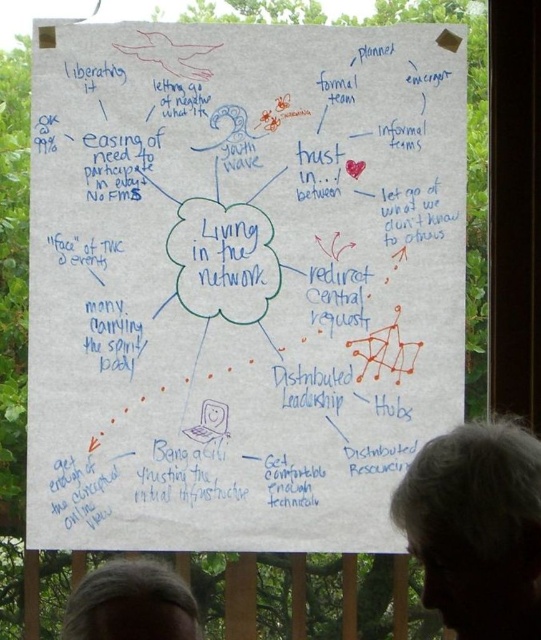
Can you confirm if white paper at center is positioned to the left of gray hair at lower right?

Yes, white paper at center is to the left of gray hair at lower right.

Who is more distant from viewer, (392,369) or (507,468)?

Point (392,369)

What are the coordinates of `white paper at center` in the screenshot? It's located at 240,282.

Locate an element on the screen. white paper at center is located at coordinates (240, 282).

Can you confirm if white paper at center is positioned below gray hair at lower left?

No.

Between point (405, 412) and point (161, 634), which one is positioned in front?

Positioned in front is point (161, 634).

The height and width of the screenshot is (640, 541). What are the coordinates of `white paper at center` in the screenshot? It's located at (240, 282).

Can you confirm if gray hair at lower right is thinner than gray hair at lower left?

Yes.

The height and width of the screenshot is (640, 541). What do you see at coordinates (477, 529) in the screenshot?
I see `gray hair at lower right` at bounding box center [477, 529].

Who is more distant from viewer, (473, 438) or (193, 608)?

The point (473, 438) is more distant.

Where is `gray hair at lower right`? The width and height of the screenshot is (541, 640). gray hair at lower right is located at coordinates (477, 529).